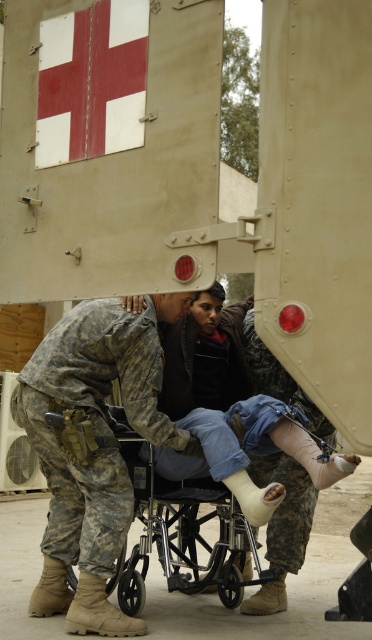
You are a military medic trying to load a patient into the ambulance. The camouflage fabric at center and the metallic silver wheelchair at center are both in the way. Which object should you move first to make more space?

You should move the metallic silver wheelchair at center first because it occupies more space than the camouflage fabric at center, according to the description.

You are a photographer positioned at the scene. You need to capture a clear photo of both the camouflage fabric at center and the metallic silver wheelchair at center. Which object will appear larger in your photo?

The camouflage fabric at center will appear larger in the photo because it is closer to the viewer than the metallic silver wheelchair at center.

You are standing 15 feet away from a military ambulance with a red cross. There is a point marked at coordinates point [91,339] on the ambulance. Can you reach that point without moving closer than 14 feet?

The distance of point [91,339] from viewer is 13.99 feet, so you are already closer than 14 feet. Therefore, you cannot reach that point without moving closer than 14 feet.